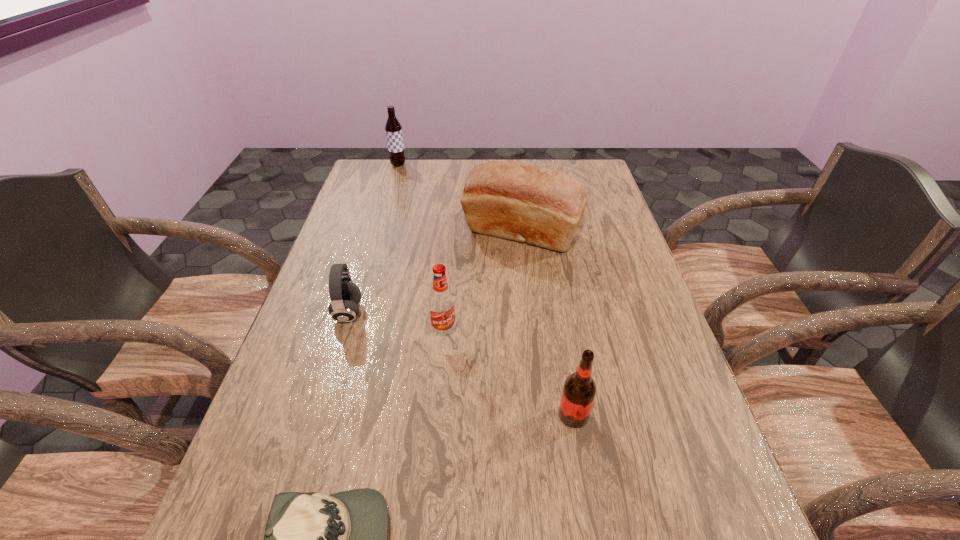
Where is `blank space at the right edge of the desktop`? This screenshot has height=540, width=960. blank space at the right edge of the desktop is located at coordinates (703, 428).

Locate an element on the screen. vacant area at the far left corner is located at coordinates (370, 173).

You are a GUI agent. You are given a task and a screenshot of the screen. Output one action in this format:
    pyautogui.click(x=<x>, y=<y>)
    Task: Click on the vacant area at the far right corner of the desktop
    This screenshot has height=540, width=960.
    Given the screenshot: What is the action you would take?
    pyautogui.click(x=555, y=164)

Find the location of a particular element. vacant area that lies between the second farthest object and the farthest root beer is located at coordinates (460, 199).

Locate an element on the screen. This screenshot has width=960, height=540. vacant area that lies between the headset and the rightmost root beer is located at coordinates (461, 364).

Locate an element on the screen. free space between the second root beer from left to right and the leftmost root beer is located at coordinates (421, 249).

Locate an element on the screen. vacant space that is in between the farthest root beer and the headset is located at coordinates (373, 239).

Where is `vacant area between the fourth object from left to right and the fifth tallest object`? This screenshot has height=540, width=960. vacant area between the fourth object from left to right and the fifth tallest object is located at coordinates (396, 323).

Find the location of `object that is the second closest one to the nearest object`. object that is the second closest one to the nearest object is located at coordinates (442, 309).

This screenshot has width=960, height=540. Identify the location of the fifth closest object to the leftmost root beer. (312, 539).